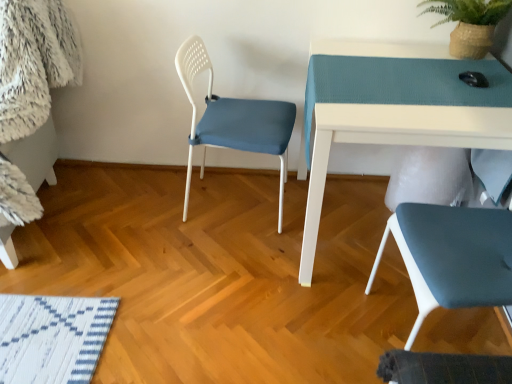
Question: Is matte blue chair at lower right, placed as the 1th chair when sorted from right to left, positioned with its back to white glossy table at upper right?

Choices:
 (A) yes
 (B) no

Answer: (B)

Question: Can you confirm if matte blue chair at lower right, which appears as the second chair when viewed from the left, is shorter than white glossy table at upper right?

Choices:
 (A) yes
 (B) no

Answer: (B)

Question: Does matte blue chair at lower right, placed as the 1th chair when sorted from right to left, contain white glossy table at upper right?

Choices:
 (A) no
 (B) yes

Answer: (A)

Question: Is matte blue chair at lower right, placed as the 1th chair when sorted from right to left, far away from white glossy table at upper right?

Choices:
 (A) no
 (B) yes

Answer: (A)

Question: Does matte blue chair at lower right, placed as the 1th chair when sorted from right to left, have a greater height compared to white glossy table at upper right?

Choices:
 (A) yes
 (B) no

Answer: (A)

Question: Is matte blue chair at lower right, which appears as the second chair when viewed from the left, bigger than white glossy table at upper right?

Choices:
 (A) no
 (B) yes

Answer: (A)

Question: Can you confirm if matte blue chair at lower right, which appears as the second chair when viewed from the left, is taller than green woven basket at upper right?

Choices:
 (A) yes
 (B) no

Answer: (A)

Question: Is matte blue chair at lower right, which appears as the second chair when viewed from the left, aimed at green woven basket at upper right?

Choices:
 (A) no
 (B) yes

Answer: (A)

Question: From the image's perspective, is matte blue chair at lower right, placed as the 1th chair when sorted from right to left, under green woven basket at upper right?

Choices:
 (A) yes
 (B) no

Answer: (A)

Question: Is matte blue chair at lower right, placed as the 1th chair when sorted from right to left, smaller than green woven basket at upper right?

Choices:
 (A) yes
 (B) no

Answer: (B)

Question: From a real-world perspective, is matte blue chair at lower right, which appears as the second chair when viewed from the left, under green woven basket at upper right?

Choices:
 (A) no
 (B) yes

Answer: (B)

Question: Can you confirm if matte blue chair at lower right, placed as the 1th chair when sorted from right to left, is positioned to the left of green woven basket at upper right?

Choices:
 (A) yes
 (B) no

Answer: (A)

Question: Does green woven basket at upper right appear on the left side of white plastic chair at center, acting as the first chair starting from the left?

Choices:
 (A) no
 (B) yes

Answer: (A)